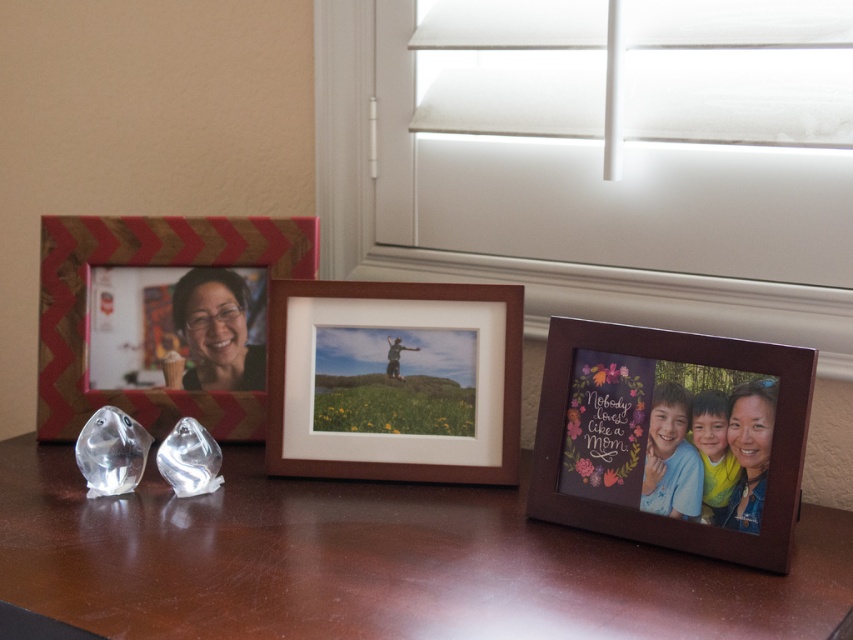
You are arranging a new photo on the wooden surface where the chevron patterned wood frame at left and the rectangular photo frame with a zigzag pattern in shades of red and brown are already placed. The new photo must be placed exactly at point (149, 264). Will the new photo overlap with the chevron patterned wood frame at left?

Yes, because the point (149, 264) marks the chevron patterned wood frame at left, so placing the new photo there would overlap with it.